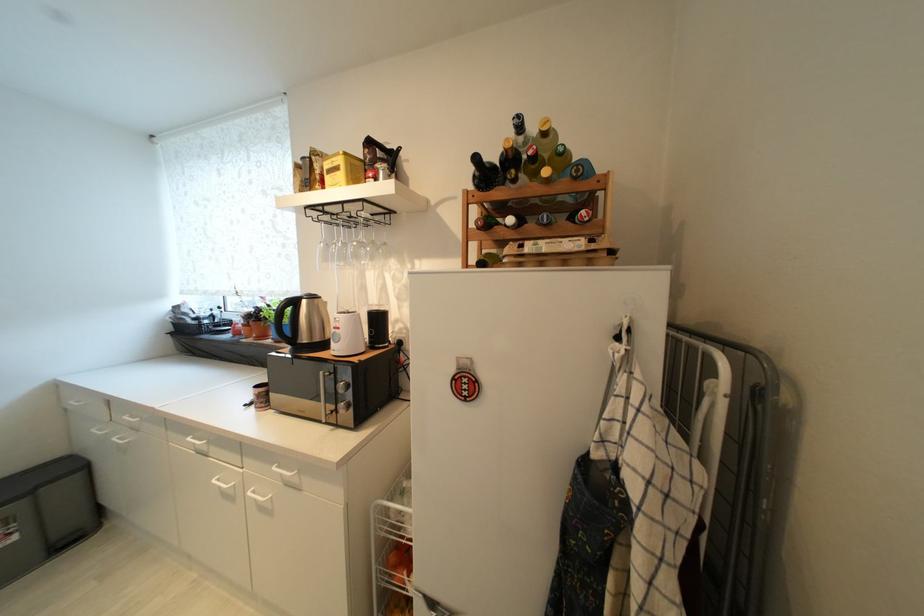
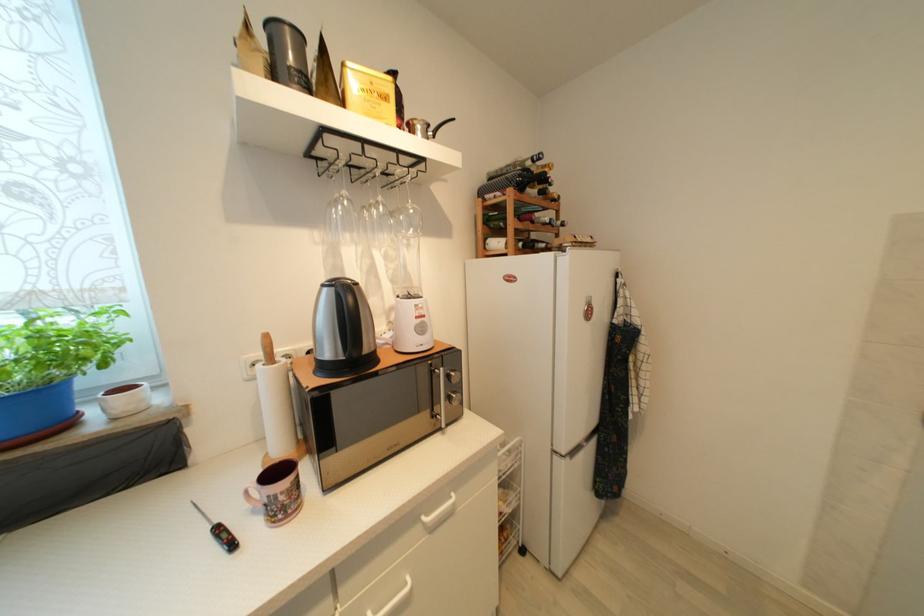
Locate, in the second image, the point that corresponds to the point at 253,407 in the first image.

(237, 546)